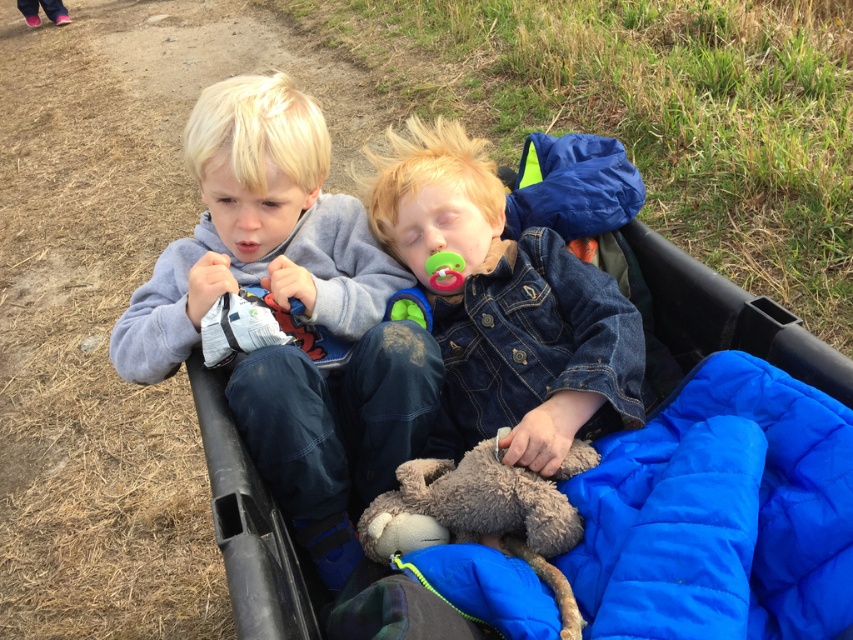
Which is more to the left, denim jacket at center or green plush toy at center?

From the viewer's perspective, green plush toy at center appears more on the left side.

Which of these two, denim jacket at center or green plush toy at center, stands taller?

denim jacket at center is taller.

Is point (549, 440) positioned after point (428, 305)?

No, it is not.

Locate an element on the screen. This screenshot has width=853, height=640. denim jacket at center is located at coordinates (505, 308).

Is black plastic baby carriage at center taller than gray plush toy at center?

Yes, black plastic baby carriage at center is taller than gray plush toy at center.

In the scene shown: Is black plastic baby carriage at center positioned at the back of gray plush toy at center?

No, black plastic baby carriage at center is closer to the viewer.

What are the coordinates of `black plastic baby carriage at center` in the screenshot? It's located at (248, 528).

Where is `black plastic baby carriage at center`? black plastic baby carriage at center is located at coordinates (248, 528).

Based on the photo, does gray plush toy at center have a lesser width compared to green plush toy at center?

No, gray plush toy at center is not thinner than green plush toy at center.

Does gray plush toy at center appear on the left side of green plush toy at center?

In fact, gray plush toy at center is to the right of green plush toy at center.

Does point (422, 492) lie in front of point (397, 307)?

Yes, point (422, 492) is closer to viewer.

I want to click on gray plush toy at center, so click(x=479, y=500).